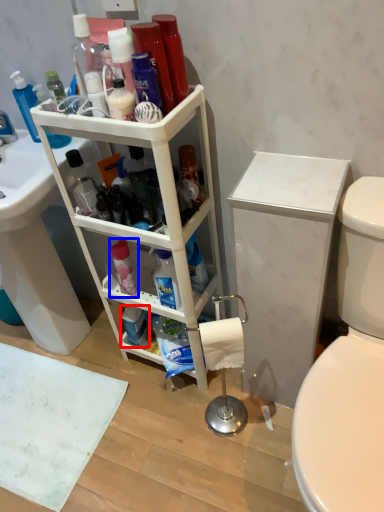
Question: Which object is closer to the camera taking this photo, toiletry (highlighted by a red box) or cleaning product (highlighted by a blue box)?

Choices:
 (A) toiletry
 (B) cleaning product

Answer: (B)